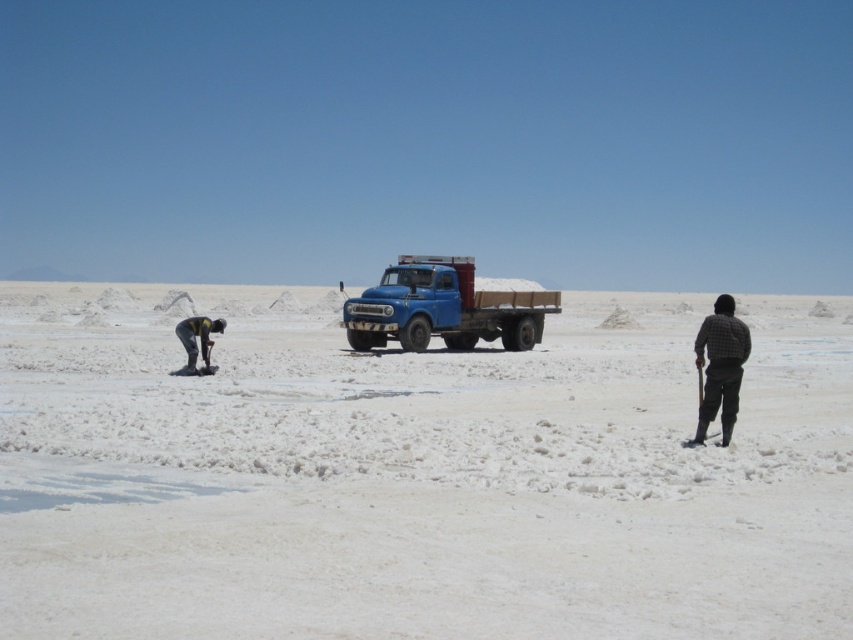
Who is higher up, blue matte truck at center or yellow fabric shirt at left?

blue matte truck at center is higher up.

Who is more forward, (405,317) or (202,339)?

Positioned in front is point (202,339).

Find the location of `blue matte truck at center`. blue matte truck at center is located at coordinates (444, 308).

Is plaid fabric shirt at right to the left of yellow fabric shirt at left from the viewer's perspective?

No, plaid fabric shirt at right is not to the left of yellow fabric shirt at left.

Is plaid fabric shirt at right wider than yellow fabric shirt at left?

Correct, the width of plaid fabric shirt at right exceeds that of yellow fabric shirt at left.

The width and height of the screenshot is (853, 640). I want to click on plaid fabric shirt at right, so click(x=720, y=365).

Which of these two, white sandy desert at center or yellow fabric shirt at left, stands taller?

Standing taller between the two is white sandy desert at center.

Is point (556, 580) behind point (177, 333)?

No, (556, 580) is closer to viewer.

This screenshot has height=640, width=853. What do you see at coordinates (416, 474) in the screenshot?
I see `white sandy desert at center` at bounding box center [416, 474].

Where is `white sandy desert at center`? The image size is (853, 640). white sandy desert at center is located at coordinates (416, 474).